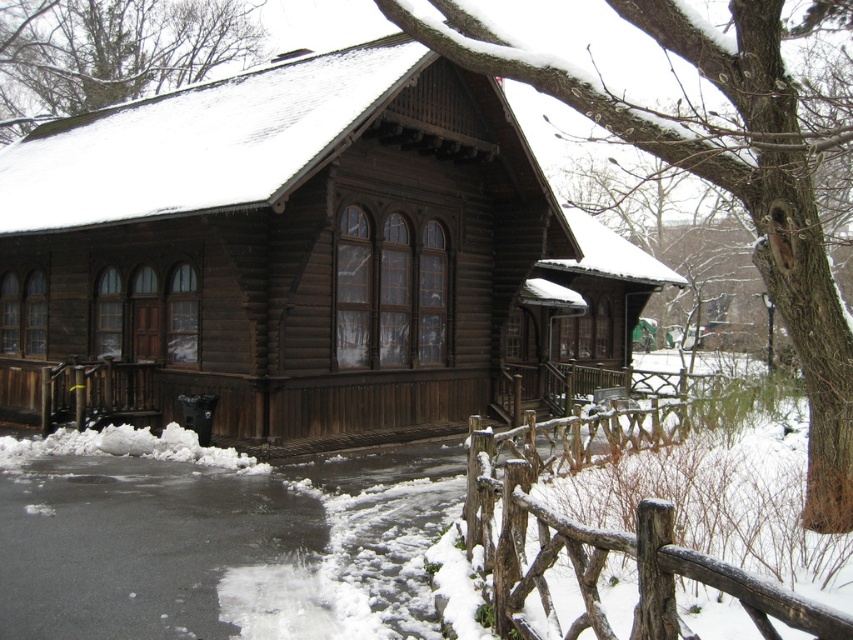
You are standing in front of the rustic wooden building covered in snow. You see a point marked at coordinates [717,184]. What is located at that point?

At point [717,184] lies smooth brown bark at center.

You are standing in front of the rustic wooden building and notice a specific point marked at coordinates (717, 184). What object is located at this point?

The smooth brown bark at center is located at point (717, 184).